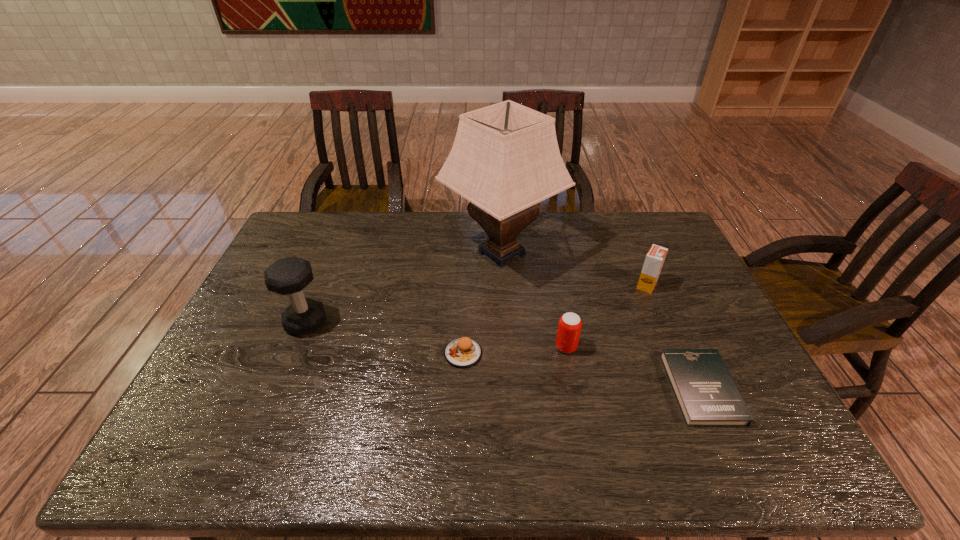
Identify the location of free space located on the right of the third shortest object. [687, 347].

Image resolution: width=960 pixels, height=540 pixels. I want to click on vacant space located 0.190m on the right of the fifth tallest object, so click(x=553, y=353).

You are a GUI agent. You are given a task and a screenshot of the screen. Output one action in this format:
    pyautogui.click(x=<x>, y=<y>)
    Task: Click on the vacant space located on the left of the shortest object
    This screenshot has width=960, height=540.
    Given the screenshot: What is the action you would take?
    pyautogui.click(x=588, y=389)

Find the location of a particular element. This screenshot has height=540, width=960. object that is at the far edge is located at coordinates (505, 159).

At what (x,y) coordinates should I click in order to perform the action: click on object located in the left edge section of the desktop. Please return your answer as a coordinate pair (x, y). The image size is (960, 540). Looking at the image, I should click on (289, 276).

This screenshot has width=960, height=540. I want to click on orange juice that is at the right edge, so click(654, 260).

In order to click on book located at the right edge in this screenshot , I will do `click(707, 395)`.

Identify the location of vacant region at the far edge of the desktop. The width and height of the screenshot is (960, 540). tap(335, 227).

The image size is (960, 540). What are the coordinates of `free space at the near edge` in the screenshot? It's located at (406, 446).

Find the location of a particular element. free point at the left edge is located at coordinates (268, 325).